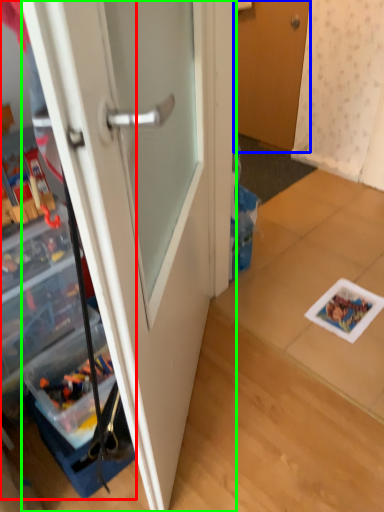
Question: Which object is the closest to the cabinetry (highlighted by a red box)? Choose among these: door (highlighted by a blue box) or door (highlighted by a green box).

Choices:
 (A) door
 (B) door

Answer: (B)